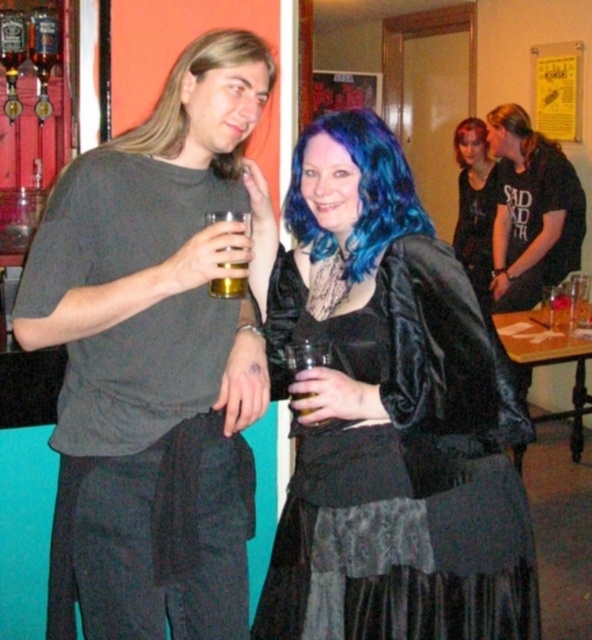
Question: Estimate the real-world distances between objects in this image. Which object is farther from the gray matte t-shirt at center?

Choices:
 (A) blue shiny hair at center
 (B) blondehair at right
 (C) black satin dress at center

Answer: (B)

Question: Can you confirm if blondehair at right is positioned above translucent glass beer at center?

Choices:
 (A) yes
 (B) no

Answer: (A)

Question: Estimate the real-world distances between objects in this image. Which object is closer to the blondehair at right?

Choices:
 (A) translucent glass beer at center
 (B) blue shiny hair at upper center
 (C) long blonde hair at upper left

Answer: (B)

Question: Can you confirm if long blonde hair at upper left is thinner than blue shiny hair at upper center?

Choices:
 (A) yes
 (B) no

Answer: (B)

Question: Which point is closer to the camera?

Choices:
 (A) click(236, 284)
 (B) click(274, 77)
 (C) click(240, 33)

Answer: (A)

Question: Is black satin dress at center behind blue shiny hair at center?

Choices:
 (A) yes
 (B) no

Answer: (B)